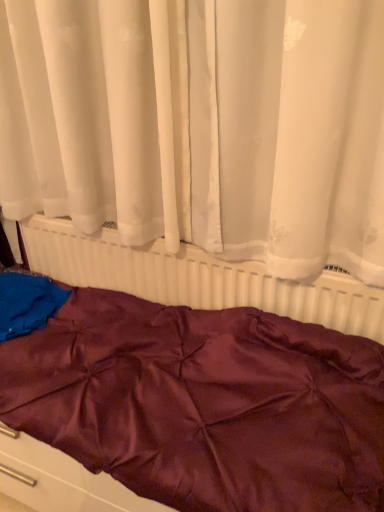
You are a GUI agent. You are given a task and a screenshot of the screen. Output one action in this format:
    pyautogui.click(x=<x>, y=<y>)
    Task: Click on the free spot above white plastic radiator at center (from a real-world perspective)
    This screenshot has width=384, height=512.
    Given the screenshot: What is the action you would take?
    pyautogui.click(x=147, y=234)